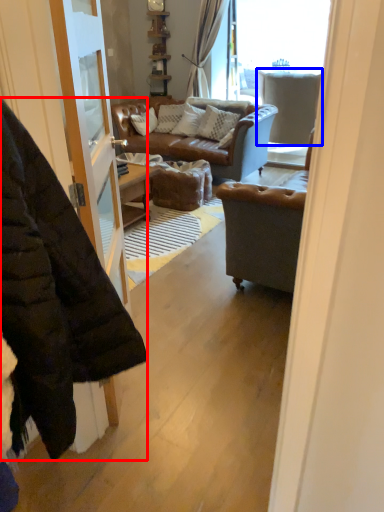
Question: Among these objects, which one is nearest to the camera, jacket (highlighted by a red box) or armchair (highlighted by a blue box)?

Choices:
 (A) jacket
 (B) armchair

Answer: (A)